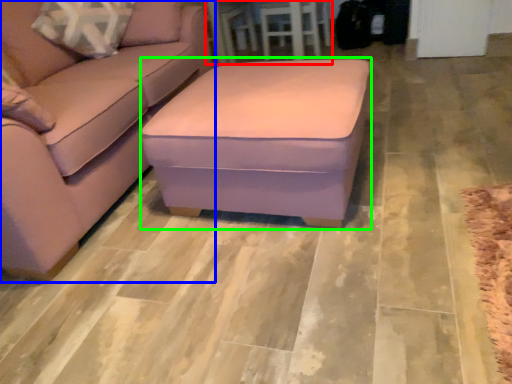
Question: Considering the real-world distances, which object is closest to table (highlighted by a red box)? studio couch (highlighted by a blue box) or stool (highlighted by a green box).

Choices:
 (A) studio couch
 (B) stool

Answer: (A)